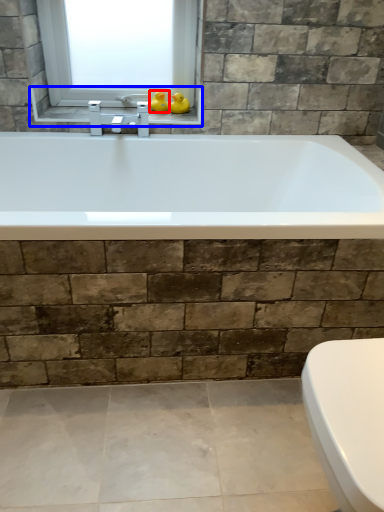
Question: Which object appears closest to the camera in this image, duck (highlighted by a red box) or window sill (highlighted by a blue box)?

Choices:
 (A) duck
 (B) window sill

Answer: (B)